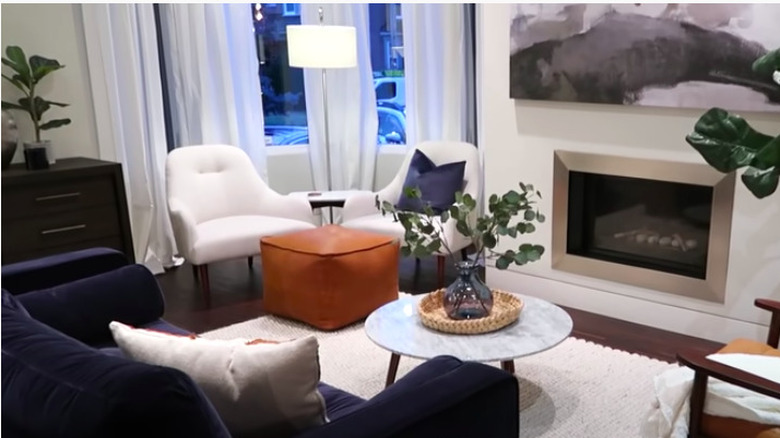
I want to click on blue sofa, so click(x=59, y=363).